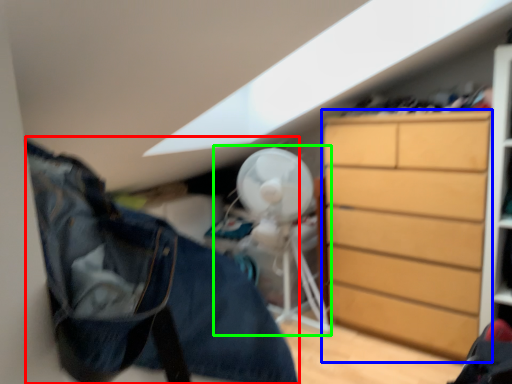
Question: Considering the real-world distances, which object is farthest from clothing (highlighted by a red box)? chest of drawers (highlighted by a blue box) or mechanical fan (highlighted by a green box)?

Choices:
 (A) chest of drawers
 (B) mechanical fan

Answer: (B)